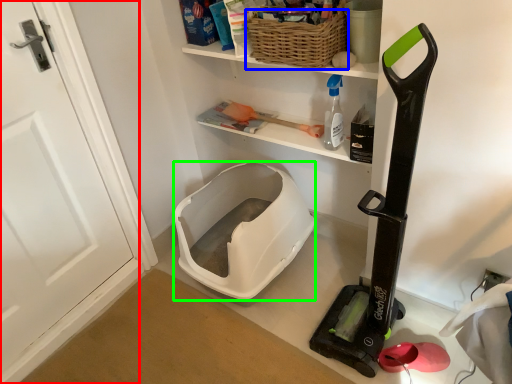
Question: Estimate the real-world distances between objects in this image. Which object is farther from door (highlighted by a red box), basket (highlighted by a blue box) or wide (highlighted by a green box)?

Choices:
 (A) basket
 (B) wide

Answer: (A)